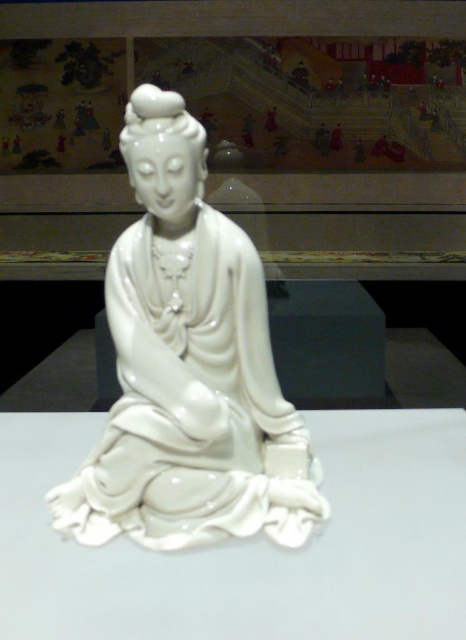
You are an art curator arranging an exhibition. You have a white glossy table at center and a glossy porcelain statue at center. Where should you place the statue so that it aligns with the table?

The glossy porcelain statue at center should be placed above the white glossy table at center since the white glossy table at center is located below the glossy porcelain statue at center.

From the picture: Please provide the coordinates of the white glossy table at center in the image. The coordinates should be in the format of a tuple with two decimal numbers between 0 and 1, representing the x and y positions respectively.

The coordinates of the white glossy table at center are at point (251, 545).